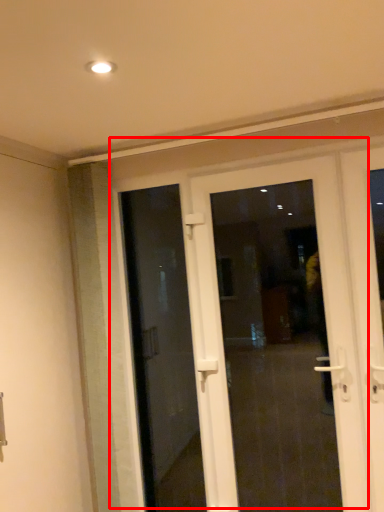
Question: From the image's perspective, what is the correct spatial relationship of door (annotated by the red box) in relation to door?

Choices:
 (A) above
 (B) below

Answer: (B)